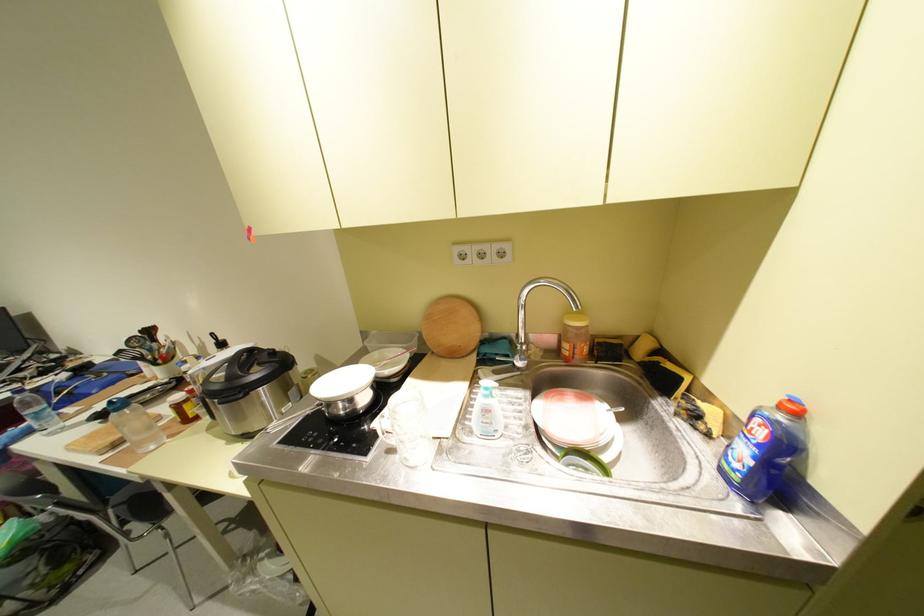
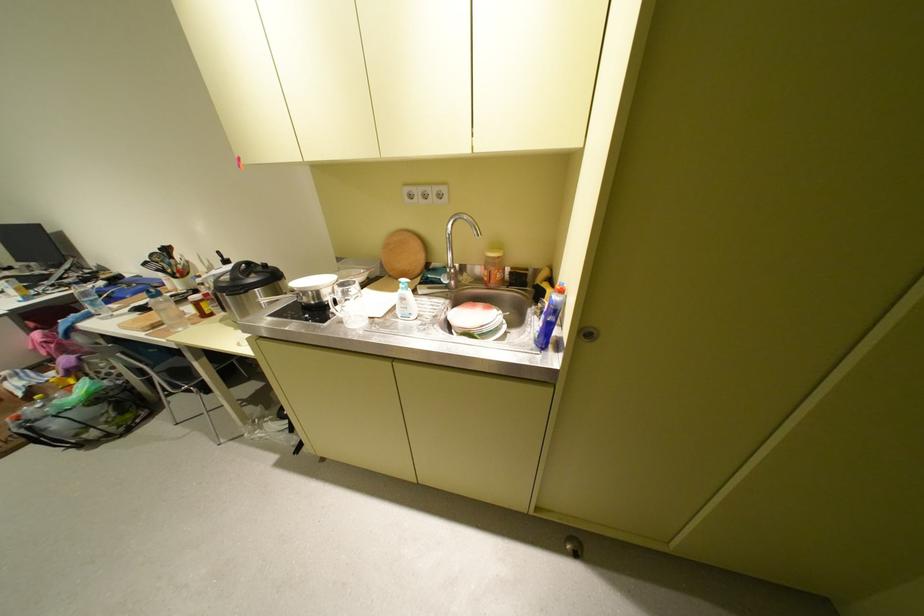
Find the pixel in the second image that matches (231,376) in the first image.

(237, 277)